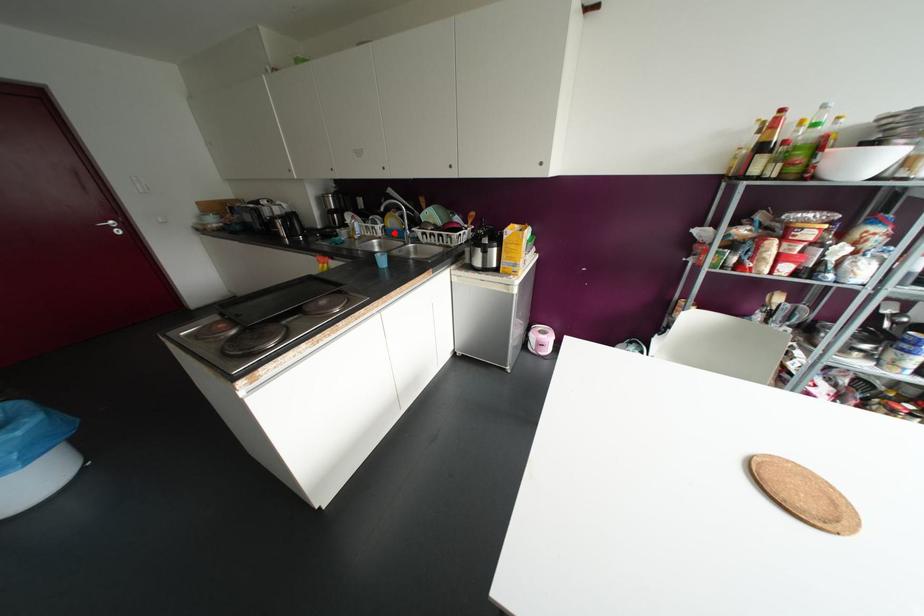
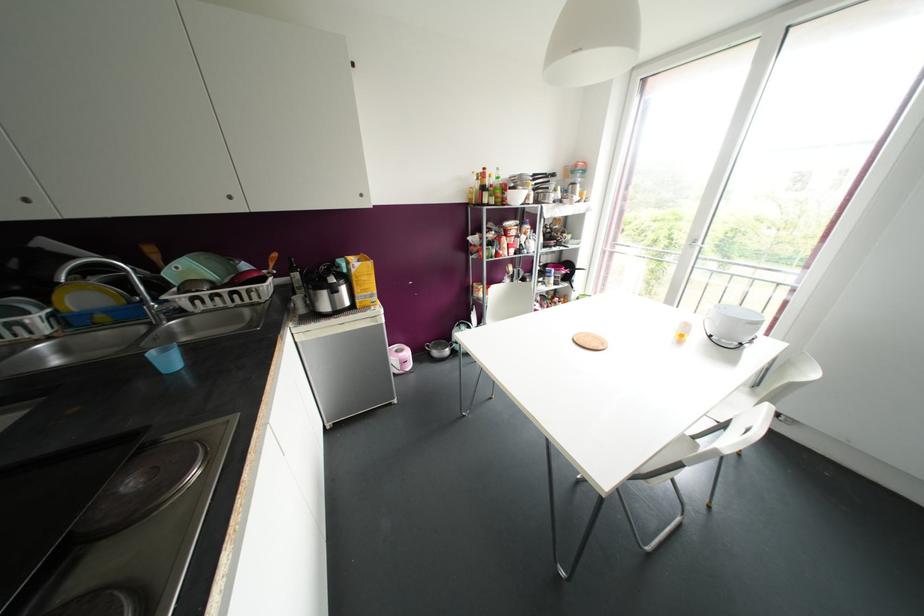
Find the pixel in the second image that matches the highlighted location in the first image.

(101, 317)